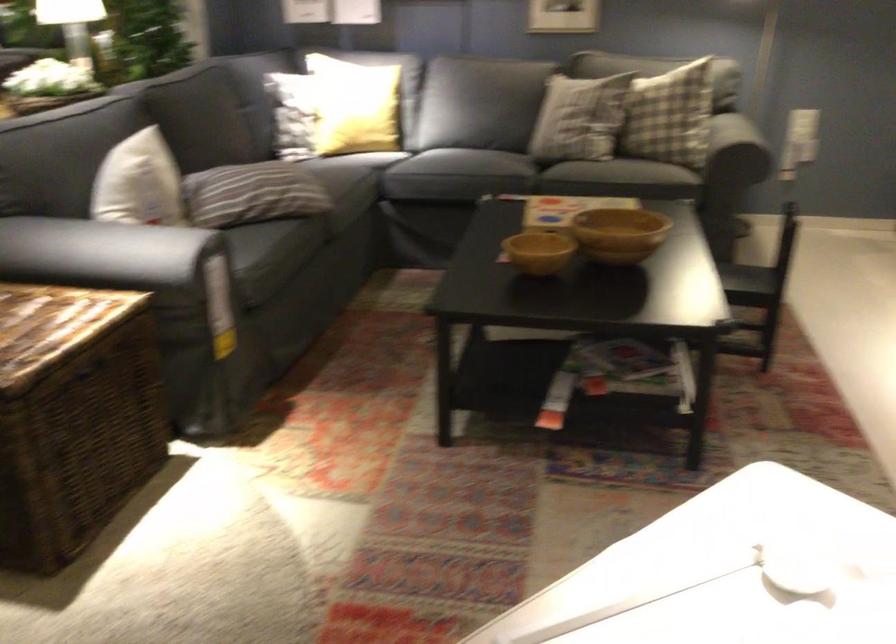
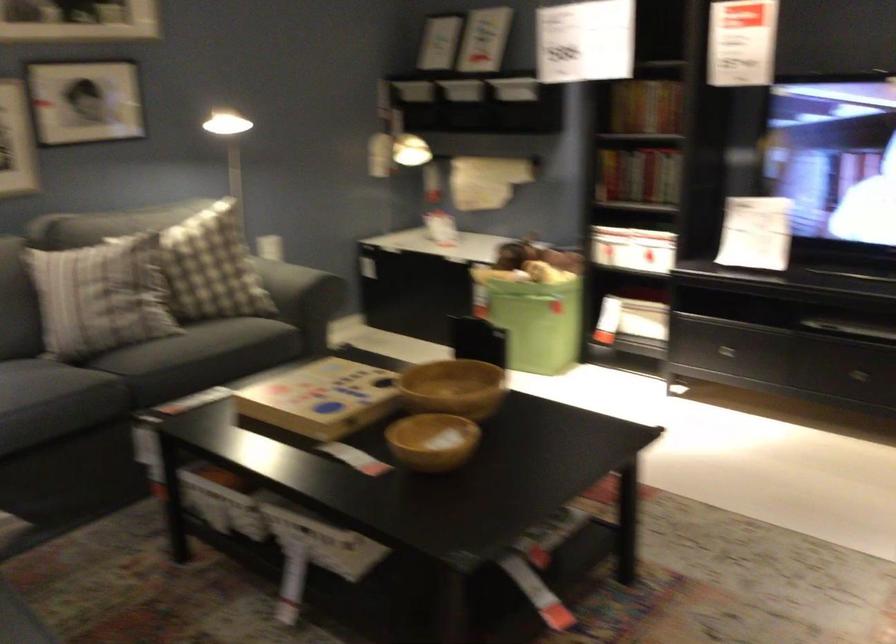
Find the pixel in the second image that matches pixel 631 232 in the first image.

(453, 388)